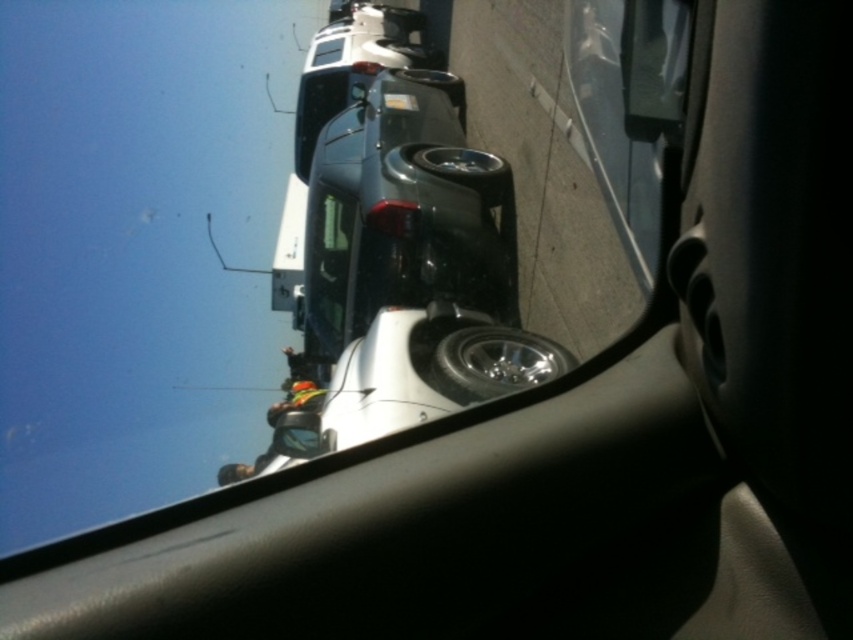
Who is taller, glossy black car at center or white plastic license plate at upper center?

With more height is glossy black car at center.

Does glossy black car at center lie in front of white plastic license plate at upper center?

Yes, glossy black car at center is in front of white plastic license plate at upper center.

Which is behind, point (419, 150) or point (410, 109)?

The point (410, 109) is behind.

The image size is (853, 640). I want to click on glossy black car at center, so click(403, 214).

Based on the photo, does glossy plastic car mirror at upper center lie in front of white plastic license plate at upper center?

Yes, it is.

The image size is (853, 640). In order to click on glossy plastic car mirror at upper center in this screenshot , I will do `click(654, 65)`.

Who is more forward, [630,36] or [399,108]?

Point [630,36] is more forward.

Find the location of a particular element. glossy plastic car mirror at upper center is located at coordinates point(654,65).

In the scene shown: Does glossy black car at center have a greater width compared to glossy plastic car mirror at upper center?

Yes.

Which of these two, glossy black car at center or glossy plastic car mirror at upper center, stands taller?

With more height is glossy black car at center.

Is point (309, 253) more distant than point (636, 67)?

Yes.

I want to click on glossy black car at center, so click(403, 214).